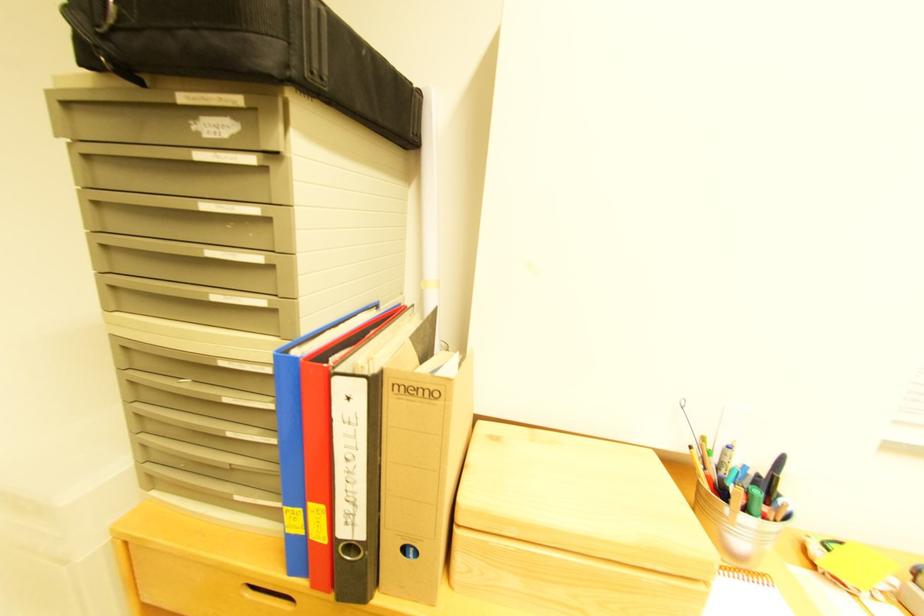
Locate an element on the screen. binder finger hole is located at coordinates (346, 568).